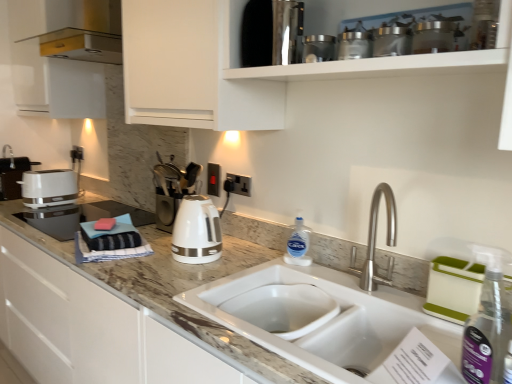
Based on the photo, what is the approximate width of clear plastic spray bottle at right, marked as the 1th bottle in a front-to-back arrangement?

4.91 inches.

Find the location of a particular element. white glossy electric kettle at center is located at coordinates (196, 231).

The height and width of the screenshot is (384, 512). Find the location of `white glossy toaster at left`. white glossy toaster at left is located at coordinates (49, 187).

What is the approximate width of white ceramic sink at center?

white ceramic sink at center is 22.35 inches in width.

At what (x,y) coordinates should I click in order to perform the action: click on metallic silver canisters at upper center, the 2th appliance positioned from the front. Please return your answer as a coordinate pair (x, y). Looking at the image, I should click on (391, 40).

Can you tell me how much white glossy toaster at left, which is the 5th appliance in right-to-left order, and marble/granite countertop at center differ in facing direction?

3.4 degrees separate the facing orientations of white glossy toaster at left, which is the 5th appliance in right-to-left order, and marble/granite countertop at center.

Looking at their sizes, would you say white glossy toaster at left, arranged as the fifth appliance when viewed from the front, is wider or thinner than marble/granite countertop at center?

In the image, white glossy toaster at left, arranged as the fifth appliance when viewed from the front, appears to be more narrow than marble/granite countertop at center.

From the picture: Is the surface of white glossy toaster at left, which is the 5th appliance in right-to-left order, in direct contact with marble/granite countertop at center?

white glossy toaster at left, which is the 5th appliance in right-to-left order, and marble/granite countertop at center are clearly separated.

Is white glossy toaster at left, which is the 5th appliance in right-to-left order, spatially inside marble/granite countertop at center, or outside of it?

white glossy toaster at left, which is the 5th appliance in right-to-left order, exists outside the volume of marble/granite countertop at center.

Is the depth of metallic stainless steel container at upper center, the 3th appliance from the back, greater than that of white glossy toaster at left, which is the 1th appliance in back-to-front order?

No.

Which is closer, (324, 56) or (18, 198)?

Point (324, 56).

Which of these two, metallic stainless steel container at upper center, which ranks as the 3th appliance in left-to-right order, or white glossy toaster at left, which is the 5th appliance in right-to-left order, stands shorter?

Standing shorter between the two is metallic stainless steel container at upper center, which ranks as the 3th appliance in left-to-right order.

Is metallic stainless steel container at upper center, the third appliance from the front, oriented towards white glossy toaster at left, which is the 5th appliance in right-to-left order?

No, metallic stainless steel container at upper center, the third appliance from the front, is not turned towards white glossy toaster at left, which is the 5th appliance in right-to-left order.

Is gold metallic exhaust hood at upper left positioned with its back to metallic silver canisters at upper center, which is the fourth appliance from back to front?

That's not correct — gold metallic exhaust hood at upper left is not looking away from metallic silver canisters at upper center, which is the fourth appliance from back to front.

Measure the distance from gold metallic exhaust hood at upper left to metallic silver canisters at upper center, marked as the 2th appliance in a right-to-left arrangement.

1.47 meters.

Is gold metallic exhaust hood at upper left outside of metallic silver canisters at upper center, marked as the 2th appliance in a right-to-left arrangement?

gold metallic exhaust hood at upper left lies outside metallic silver canisters at upper center, marked as the 2th appliance in a right-to-left arrangement,'s area.

Is gold metallic exhaust hood at upper left beside metallic silver canisters at upper center, which is the fourth appliance from back to front?

gold metallic exhaust hood at upper left and metallic silver canisters at upper center, which is the fourth appliance from back to front, are clearly separated.

Is satin silver electrical outlet at upper center shorter than stainless steel coffee maker at upper center, acting as the 4th appliance starting from the right?

Yes, satin silver electrical outlet at upper center is shorter than stainless steel coffee maker at upper center, acting as the 4th appliance starting from the right.

From the image's perspective, between satin silver electrical outlet at upper center and stainless steel coffee maker at upper center, the second appliance viewed from the left, who is located below?

satin silver electrical outlet at upper center appears lower in the image.

Considering their positions, is satin silver electrical outlet at upper center located in front of or behind stainless steel coffee maker at upper center, the 2th appliance viewed from the back?

In the image, satin silver electrical outlet at upper center appears behind stainless steel coffee maker at upper center, the 2th appliance viewed from the back.

You are a GUI agent. You are given a task and a screenshot of the screen. Output one action in this format:
    pyautogui.click(x=<x>, y=<y>)
    Task: Click on the 1st bottle directly beneath the metallic silver canisters at upper center, which is counted as the 4th appliance, starting from the left (from a real-world perspective)
    The width and height of the screenshot is (512, 384).
    Given the screenshot: What is the action you would take?
    pyautogui.click(x=487, y=323)

Is metallic silver canisters at upper center, marked as the 2th appliance in a right-to-left arrangement, wider or thinner than clear plastic spray bottle at right, acting as the first bottle starting from the right?

Clearly, metallic silver canisters at upper center, marked as the 2th appliance in a right-to-left arrangement, has more width compared to clear plastic spray bottle at right, acting as the first bottle starting from the right.

Considering the sizes of objects metallic silver canisters at upper center, which is the fourth appliance from back to front, and clear plastic spray bottle at right, which ranks as the 2th bottle in back-to-front order, in the image provided, who is taller, metallic silver canisters at upper center, which is the fourth appliance from back to front, or clear plastic spray bottle at right, which ranks as the 2th bottle in back-to-front order,?

clear plastic spray bottle at right, which ranks as the 2th bottle in back-to-front order.

From a real-world perspective, relative to clear plastic spray bottle at right, marked as the 1th bottle in a front-to-back arrangement, is metallic silver canisters at upper center, marked as the 2th appliance in a right-to-left arrangement, vertically above or below?

In terms of real-world spatial position, metallic silver canisters at upper center, marked as the 2th appliance in a right-to-left arrangement, is above clear plastic spray bottle at right, marked as the 1th bottle in a front-to-back arrangement.

From the image's perspective, which appliance is the 2nd one below the metallic silver canisters at upper center, which is the fourth appliance from back to front? Please provide its 2D coordinates.

[(13, 176)]

Who is smaller, white glossy toaster at left, arranged as the fifth appliance when viewed from the front, or metallic silver canisters at upper center, the 2th appliance positioned from the front?

metallic silver canisters at upper center, the 2th appliance positioned from the front, is smaller.

From the image's perspective, between white glossy toaster at left, which is the 5th appliance in right-to-left order, and metallic silver canisters at upper center, which is counted as the 4th appliance, starting from the left, who is located below?

From the image's view, white glossy toaster at left, which is the 5th appliance in right-to-left order, is below.

From a real-world perspective, which object rests below the other?

white glossy toaster at left, arranged as the fifth appliance when viewed from the front, from a real-world perspective.

Considering their positions, is metallic glass jars at upper center, which is the fifth appliance in back-to-front order, located in front of or behind stainless steel coffee maker at upper center, the second appliance viewed from the left?

In the image, metallic glass jars at upper center, which is the fifth appliance in back-to-front order, appears in front of stainless steel coffee maker at upper center, the second appliance viewed from the left.

Considering the relative sizes of metallic glass jars at upper center, the 1th appliance from the right, and stainless steel coffee maker at upper center, the 2th appliance viewed from the back, in the image provided, is metallic glass jars at upper center, the 1th appliance from the right, smaller than stainless steel coffee maker at upper center, the 2th appliance viewed from the back,?

Yes.

In the scene shown: Is stainless steel coffee maker at upper center, acting as the 4th appliance starting from the right, a part of metallic glass jars at upper center, which is the fifth appliance in back-to-front order?

No.

Starting from the metallic glass jars at upper center, the 1th appliance from the right, which appliance is the 3rd one to the left? Please provide its 2D coordinates.

[(271, 32)]

Which appliance is the 5th one when counting from the back of the marble/granite countertop at center? Please provide its 2D coordinates.

[(13, 176)]

You are a GUI agent. You are given a task and a screenshot of the screen. Output one action in this format:
    pyautogui.click(x=<x>, y=<y>)
    Task: Click on the appliance that is the 3rd object located above the white glossy toaster at left, which is the 5th appliance in right-to-left order (from the image's perspective)
    This screenshot has width=512, height=384.
    Given the screenshot: What is the action you would take?
    pyautogui.click(x=318, y=48)

Looking at the image, which one is located closer to white matte cabinet at upper center, satin silver electrical outlet at upper center or gold metallic exhaust hood at upper left?

gold metallic exhaust hood at upper left is positioned closer to the anchor white matte cabinet at upper center.

Looking at the image, which one is located closer to white ceramic sink at center, satin silver electrical outlet at upper center or white matte cabinet at upper center?

white matte cabinet at upper center lies closer to white ceramic sink at center than the other object.

Based on their spatial positions, is white matte cabinet at upper center or white glossy toaster at left, which is the first appliance from left to right, closer to metallic stainless steel container at upper center, the 3th appliance from the back?

white matte cabinet at upper center lies closer to metallic stainless steel container at upper center, the 3th appliance from the back, than the other object.

From the image, which object appears to be farther from white matte cabinet at upper center, satin silver electrical outlet at upper center or white glossy toaster at left, arranged as the fifth appliance when viewed from the front?

satin silver electrical outlet at upper center is positioned further to the anchor white matte cabinet at upper center.

From the image, which object appears to be nearer to white glossy toaster at left, which is the 1th appliance in back-to-front order, white glossy toaster at left or metallic glass jars at upper center, the 1th appliance from the right?

white glossy toaster at left.

Considering their positions, is white ceramic sink at center positioned closer to metallic silver canisters at upper center, which is counted as the 4th appliance, starting from the left, than metallic glass jars at upper center, acting as the 1th appliance starting from the front?

metallic glass jars at upper center, acting as the 1th appliance starting from the front.

Which object lies further to the anchor point clear plastic spray bottle at right, which ranks as the 2th bottle in back-to-front order, stainless steel coffee maker at upper center, the 2th appliance viewed from the back, or clear plastic bottle at sink, which is counted as the 2th bottle, starting from the right?

stainless steel coffee maker at upper center, the 2th appliance viewed from the back.

Based on their spatial positions, is metallic stainless steel container at upper center, which appears as the third appliance when viewed from the right, or metallic silver canisters at upper center, marked as the 2th appliance in a right-to-left arrangement, further from white glossy electric kettle at center?

metallic silver canisters at upper center, marked as the 2th appliance in a right-to-left arrangement.

This screenshot has height=384, width=512. I want to click on bottle located between white glossy toaster at left, which is the 1th appliance in back-to-front order, and metallic glass jars at upper center, the 5th appliance when ordered from left to right, in the left-right direction, so (298, 244).

The image size is (512, 384). In order to click on sink between white glossy toaster at left, which is the 1th appliance in back-to-front order, and clear plastic spray bottle at right, the 2th bottle when ordered from left to right in this screenshot , I will do `click(329, 322)`.

Where is `home appliance between metallic stainless steel container at upper center, the 3th appliance from the back, and white ceramic sink at center in the up-down direction`? home appliance between metallic stainless steel container at upper center, the 3th appliance from the back, and white ceramic sink at center in the up-down direction is located at coordinates (196, 231).

You are a GUI agent. You are given a task and a screenshot of the screen. Output one action in this format:
    pyautogui.click(x=<x>, y=<y>)
    Task: Click on the home appliance between white matte cabinet at upper center and clear plastic bottle at sink, which is the 1th bottle from back to front, in the vertical direction
    The height and width of the screenshot is (384, 512).
    Given the screenshot: What is the action you would take?
    pyautogui.click(x=196, y=231)